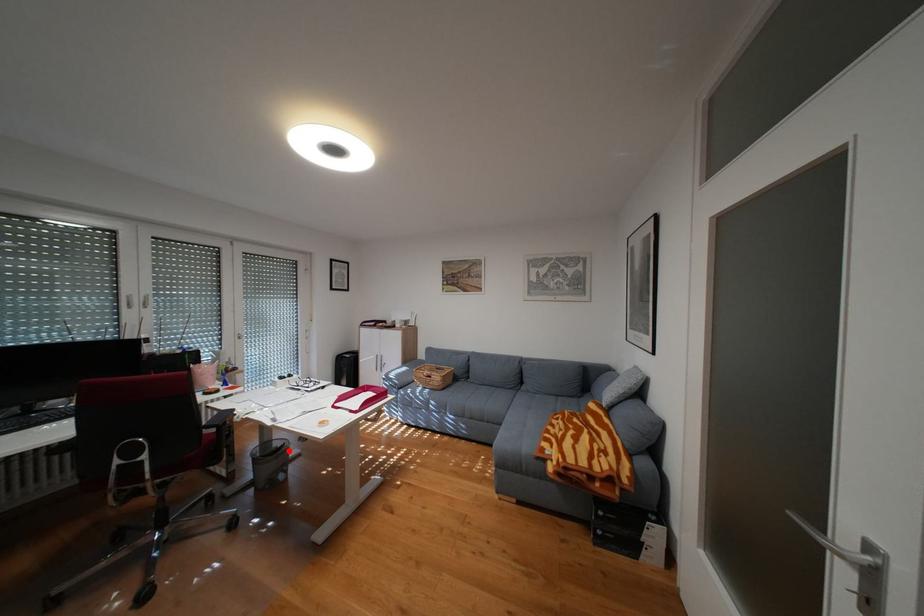
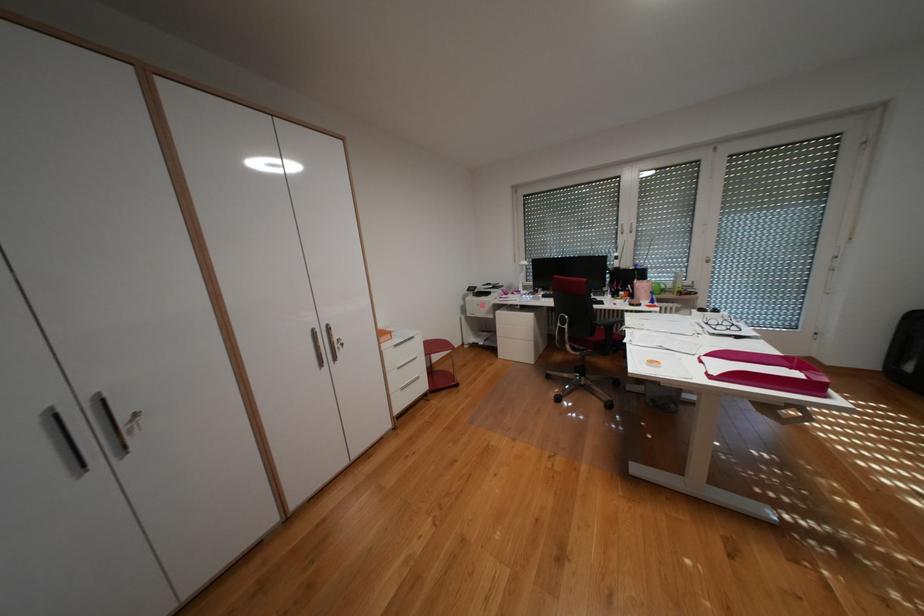
Question: I am providing you with two images of the same scene from different viewpoints. A red point is marked on the first image. Is the red point's position out of view in image 2?

Choices:
 (A) Yes
 (B) No

Answer: (A)